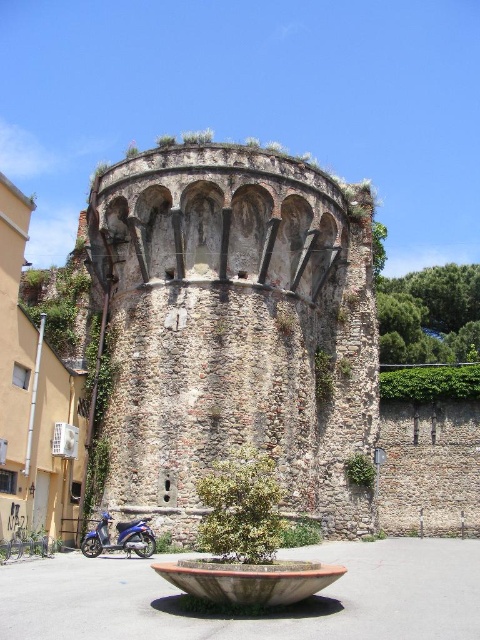
Based on the scene description, what is the 2D coordinate of the stone textured tower at center?

The stone textured tower at center is located at the 2D coordinate point of (235,326).